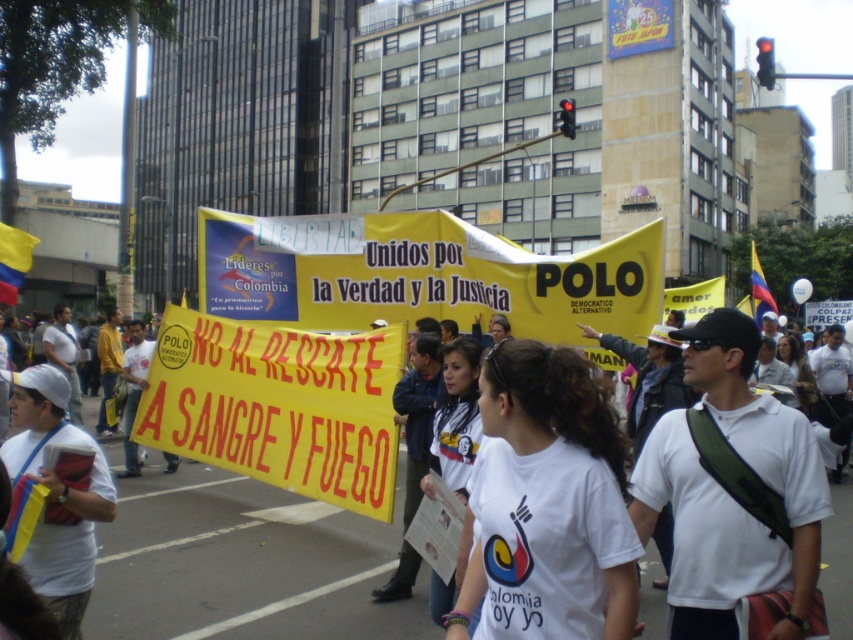
You are a photographer trying to capture the most prominent banner in the scene. Given that the yellow paper banner at center is positioned at coordinates 0.634 on the x and 0.327 on the y axis, how would you adjust your camera to frame this banner properly?

The yellow paper banner at center is located at point (277, 404), so you should position your camera to focus on the center area slightly to the right and lower portion of the frame to capture the banner effectively.

You are a photographer trying to capture the protest scene. You want to focus on the white fabric shirt at left and the yellow paper banner at center. Can you see both clearly in your photo?

The white fabric shirt at left is behind the yellow paper banner at center, so the yellow paper banner at center will block part of the white fabric shirt at left in the photo.

You are a photographer standing in the middle of the protest. You want to take a photo that includes both the yellow banner with red and black text and the partially obscured banner. However, you notice two points of light in your viewfinder at coordinates point [189,342] and point [9,454]. Which point is closer to you, the photographer?

Point [189,342] is further to the viewer than point [9,454], so the point closer to you is point [9,454].